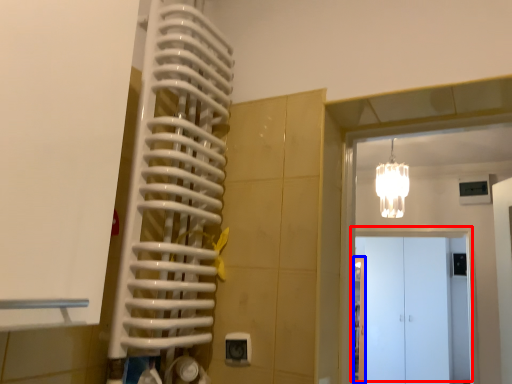
Question: Which point is closer to the camera, door (highlighted by a red box) or door (highlighted by a blue box)?

Choices:
 (A) door
 (B) door

Answer: (A)